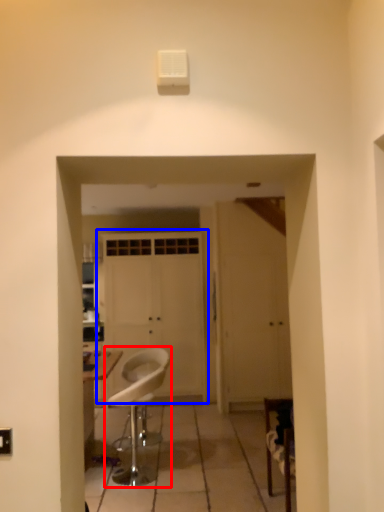
Question: Among these objects, which one is nearest to the camera, chair (highlighted by a red box) or door (highlighted by a blue box)?

Choices:
 (A) chair
 (B) door

Answer: (A)